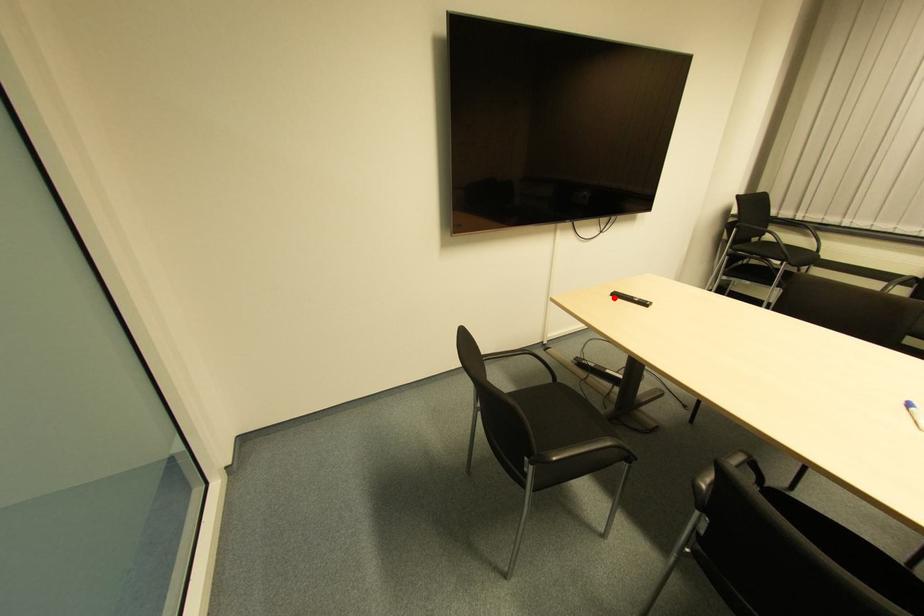
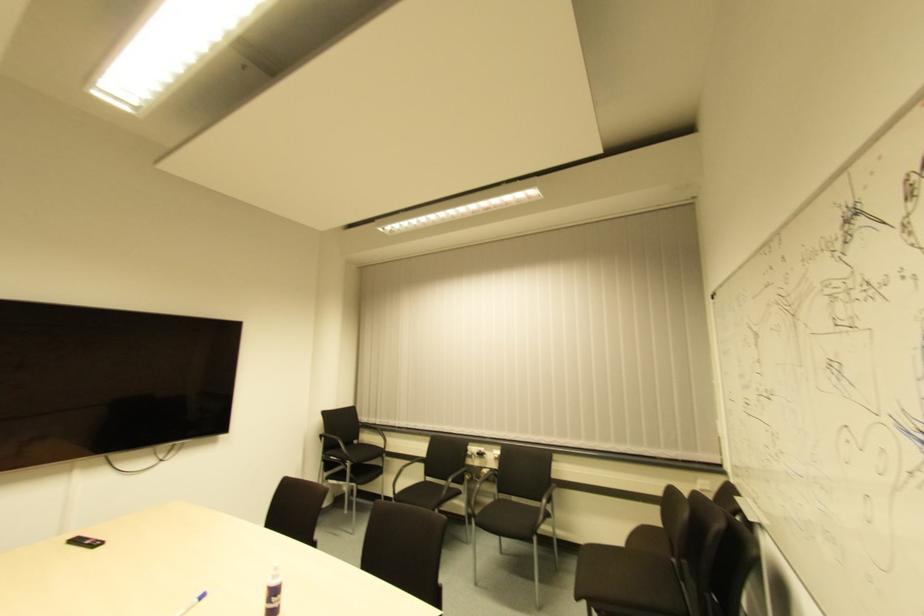
Where in the second image is the point corresponding to the highlighted location from the first image?

(73, 543)